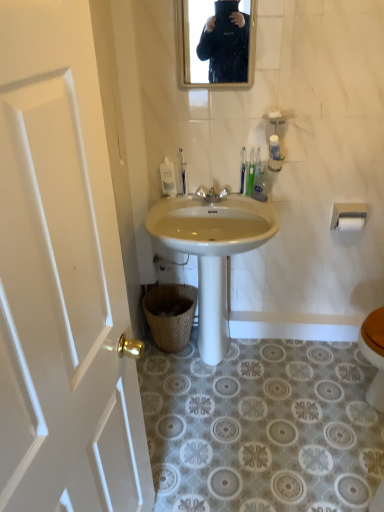
Question: Is white wood door at left spatially inside white matte toilet paper at upper right, acting as the 1th toilet paper starting from the top, or outside of it?

Choices:
 (A) outside
 (B) inside

Answer: (A)

Question: Looking at their shapes, would you say white wood door at left is wider or thinner than white matte toilet paper at upper right, the 2th toilet paper when ordered from bottom to top?

Choices:
 (A) wide
 (B) thin

Answer: (A)

Question: Which of these objects is positioned closest to the white wood door at left?

Choices:
 (A) white glossy sink at center
 (B) white plastic toilet brush at center, which is counted as the third toilet brush, starting from the right
 (C) green plastic toothbrush at upper center, arranged as the 3th toilet brush when viewed from the left
 (D) white plastic toothbrush at upper center, which ranks as the 2th toilet brush in left-to-right order
 (E) white matte toilet paper at upper right, the 2th toilet paper positioned from the top

Answer: (A)

Question: Which object is the farthest from the green plastic toothbrush at upper center?

Choices:
 (A) woven brown basket at lower center
 (B) white plastic toilet brush at center, which is the first toilet brush in left-to-right order
 (C) matte black mirror at upper center
 (D) white matte toilet paper at upper right, placed as the first toilet paper when sorted from bottom to top
 (E) white matte toilet paper at upper right, the 2th toilet paper when ordered from bottom to top

Answer: (C)